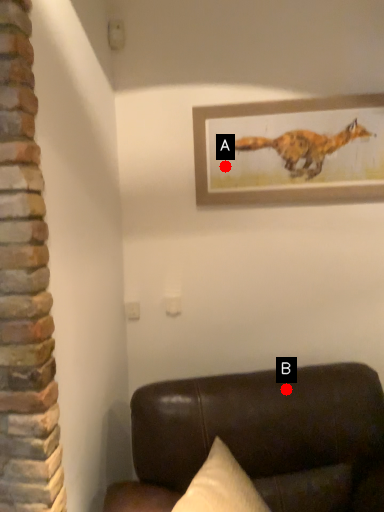
Question: Two points are circled on the image, labeled by A and B beside each circle. Which point is further to the camera?

Choices:
 (A) A is further
 (B) B is further

Answer: (A)